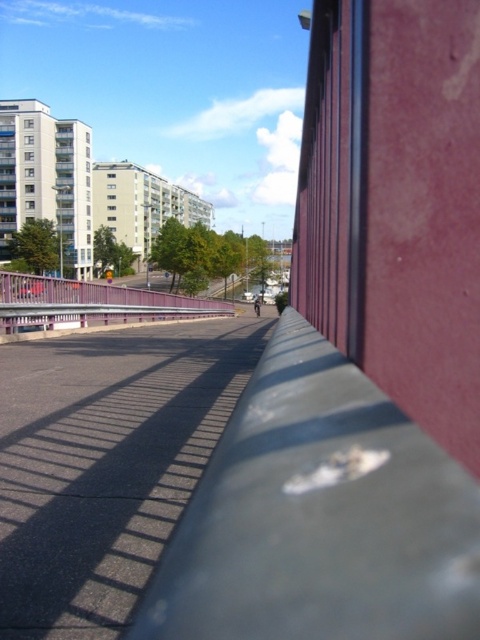
Question: Can you confirm if smooth gray concrete barrier at center is positioned below pink metallic rail at center?

Choices:
 (A) yes
 (B) no

Answer: (A)

Question: Which of the following is the closest to the observer?

Choices:
 (A) (406, 515)
 (B) (172, 296)

Answer: (A)

Question: Does smooth gray concrete barrier at center have a greater width compared to pink metallic rail at center?

Choices:
 (A) yes
 (B) no

Answer: (B)

Question: Is smooth gray concrete barrier at center smaller than pink metallic rail at center?

Choices:
 (A) yes
 (B) no

Answer: (A)

Question: Which of the following is the closest to the observer?

Choices:
 (A) smooth gray concrete barrier at center
 (B) pink metallic rail at center

Answer: (A)